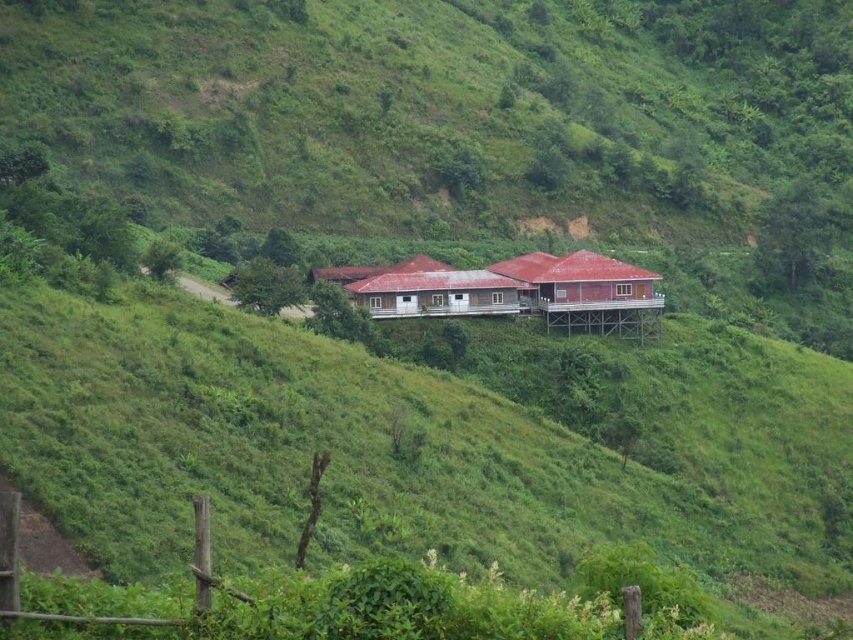
Question: Does wooden hut at center have a lesser width compared to brown wooden house at center?

Choices:
 (A) no
 (B) yes

Answer: (A)

Question: Does wooden hut at center come behind brown wooden house at center?

Choices:
 (A) yes
 (B) no

Answer: (B)

Question: Does wooden hut at center come behind brown wooden house at center?

Choices:
 (A) yes
 (B) no

Answer: (B)

Question: Which of the following is the farthest from the observer?

Choices:
 (A) brown wooden house at center
 (B) wooden hut at center

Answer: (A)

Question: Which of the following is the farthest from the observer?

Choices:
 (A) wooden hut at center
 (B) brown wooden house at center

Answer: (B)

Question: Which point appears closest to the camera in this image?

Choices:
 (A) (527, 291)
 (B) (415, 308)

Answer: (B)